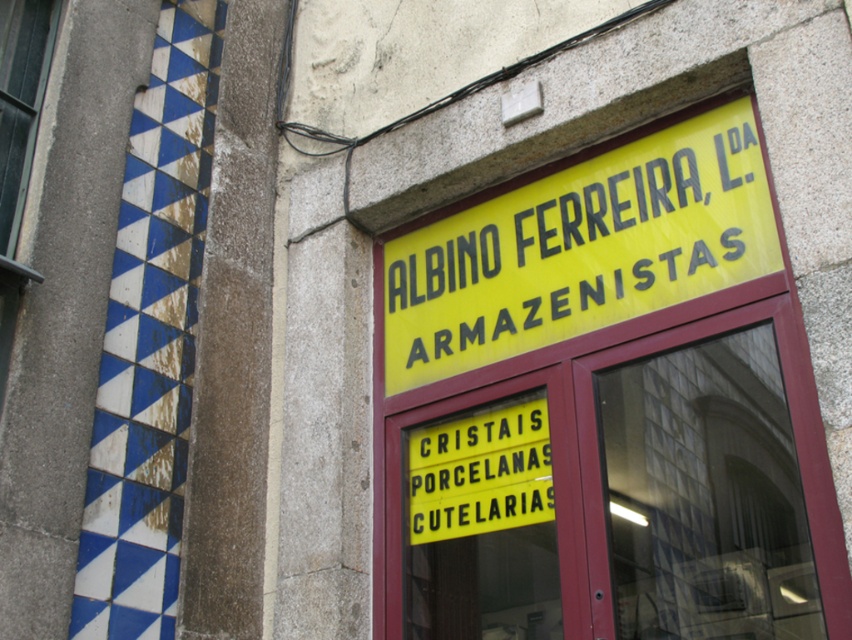
Question: Which point appears closest to the camera in this image?

Choices:
 (A) (675, 252)
 (B) (528, 465)
 (C) (32, 156)

Answer: (A)

Question: Which object is closer to the camera taking this photo?

Choices:
 (A) clear glass window at upper left
 (B) yellow plastic sign at upper center

Answer: (B)

Question: Which of the following is the farthest from the observer?

Choices:
 (A) (39, 29)
 (B) (471, 508)

Answer: (A)

Question: Observing the image, what is the correct spatial positioning of yellow plastic sign at upper center in reference to clear glass window at upper left?

Choices:
 (A) above
 (B) below

Answer: (B)

Question: Is yellow plastic sign at center closer to camera compared to clear glass window at upper left?

Choices:
 (A) yes
 (B) no

Answer: (A)

Question: Can you confirm if yellow plastic sign at upper center is positioned to the right of yellow plastic sign at center?

Choices:
 (A) yes
 (B) no

Answer: (A)